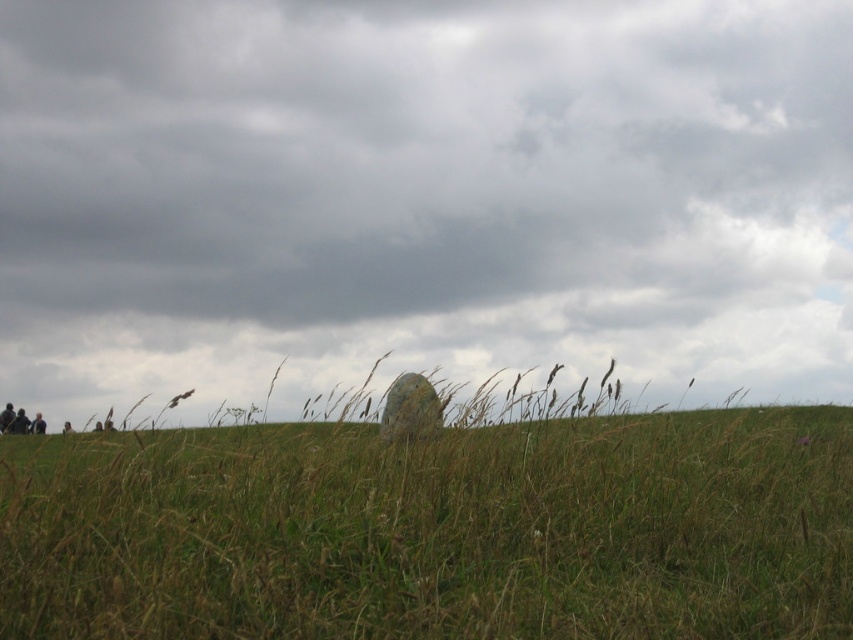
Consider the image. You are standing in the open landscape depicted in the image. You notice a point marked at coordinates (421, 195). Based on the scene description, what does this point indicate?

The point at coordinates (421, 195) marks the gray cloudy sky at upper center.

You are standing in the open landscape and want to take a photo with the gray cloudy sky at upper center and the green grass at center. Which object will appear larger in the photo?

The gray cloudy sky at upper center is much taller than the green grass at center, so it will appear larger in the photo.